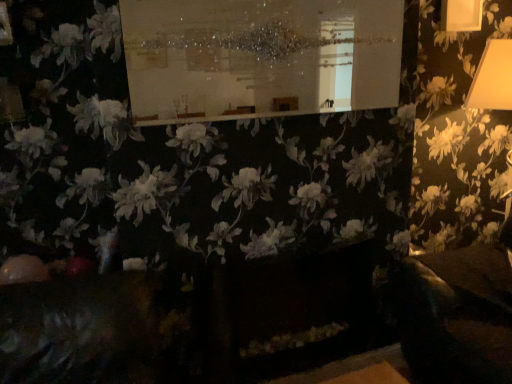
Question: From a real-world perspective, is white glossy board at upper center physically below yellow matte lampshade at right?

Choices:
 (A) yes
 (B) no

Answer: (B)

Question: From a real-world perspective, is white glossy board at upper center on top of yellow matte lampshade at right?

Choices:
 (A) no
 (B) yes

Answer: (B)

Question: Is white glossy board at upper center not close to yellow matte lampshade at right?

Choices:
 (A) no
 (B) yes

Answer: (B)

Question: Is white glossy board at upper center at the right side of yellow matte lampshade at right?

Choices:
 (A) no
 (B) yes

Answer: (A)

Question: From the image's perspective, is white glossy board at upper center above yellow matte lampshade at right?

Choices:
 (A) no
 (B) yes

Answer: (B)

Question: Is white glossy board at upper center at the left side of yellow matte lampshade at right?

Choices:
 (A) no
 (B) yes

Answer: (B)

Question: Is yellow matte lampshade at right oriented towards white glossy board at upper center?

Choices:
 (A) yes
 (B) no

Answer: (B)

Question: From the image's perspective, does yellow matte lampshade at right appear lower than white glossy board at upper center?

Choices:
 (A) yes
 (B) no

Answer: (A)

Question: Is yellow matte lampshade at right positioned far away from white glossy board at upper center?

Choices:
 (A) yes
 (B) no

Answer: (A)

Question: Is yellow matte lampshade at right shorter than white glossy board at upper center?

Choices:
 (A) yes
 (B) no

Answer: (B)

Question: Can you confirm if yellow matte lampshade at right is smaller than white glossy board at upper center?

Choices:
 (A) yes
 (B) no

Answer: (B)

Question: Can you confirm if yellow matte lampshade at right is positioned to the right of white glossy board at upper center?

Choices:
 (A) yes
 (B) no

Answer: (A)

Question: Is white glossy board at upper center to the left or to the right of yellow matte lampshade at right in the image?

Choices:
 (A) left
 (B) right

Answer: (A)